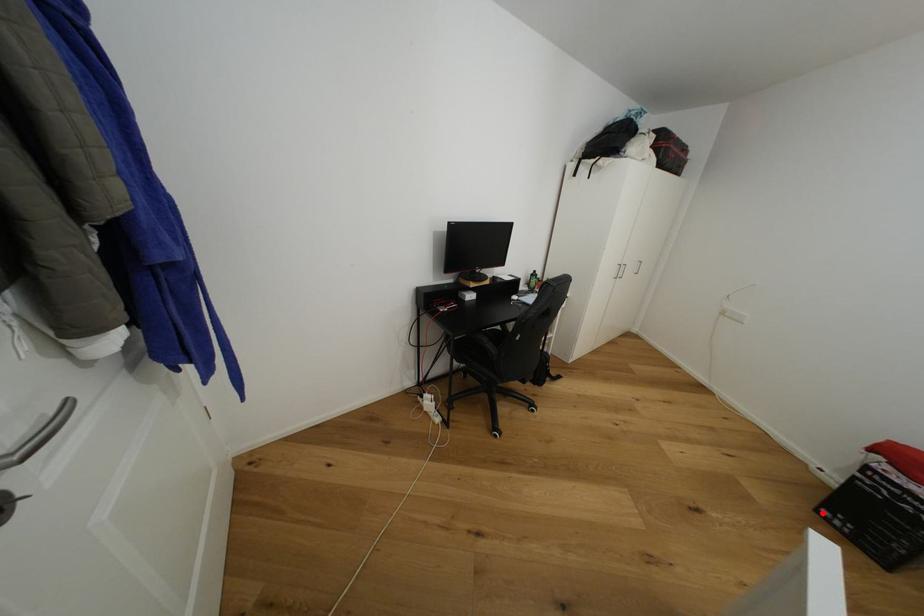
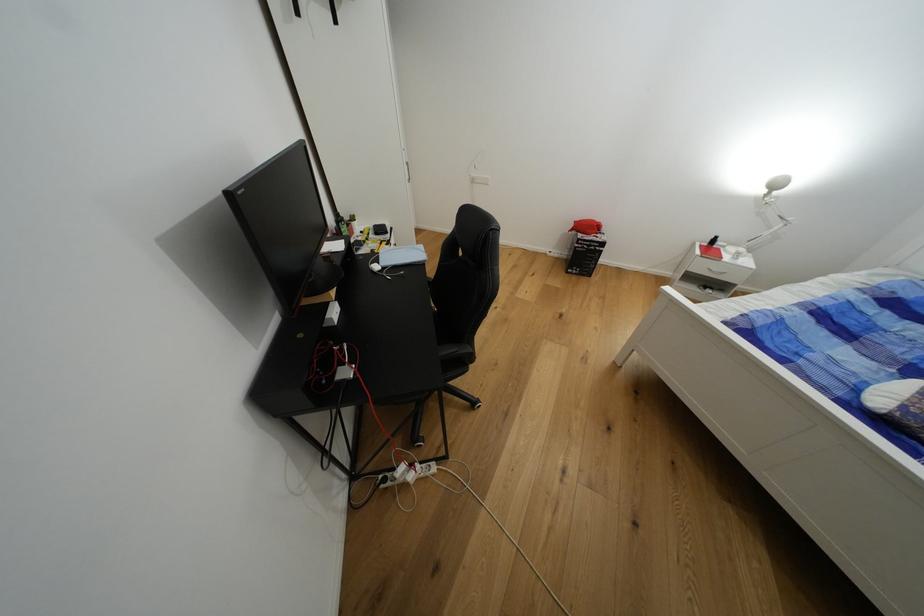
Question: I am providing you with two images of the same scene from different viewpoints. Given a red point in image1, look at the same physical point in image2. Is it:

Choices:
 (A) Closer to the viewpoint
 (B) Farther from the viewpoint

Answer: (B)